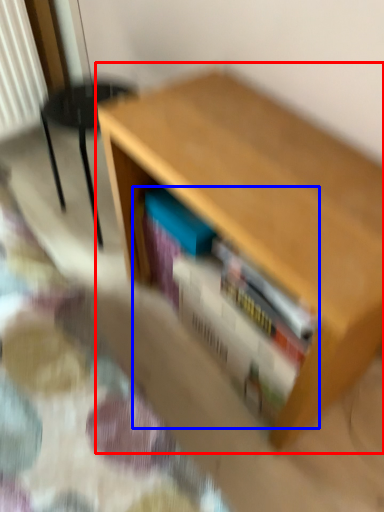
Question: Which object appears closest to the camera in this image, table (highlighted by a red box) or book (highlighted by a blue box)?

Choices:
 (A) table
 (B) book

Answer: (A)